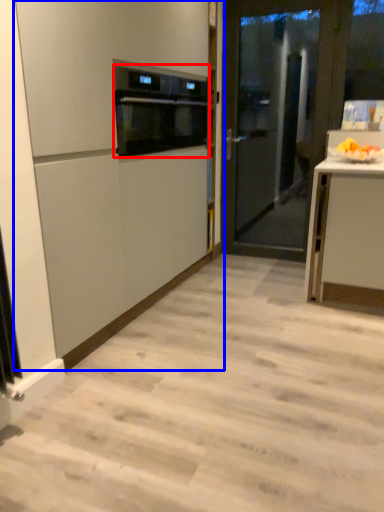
Question: Which object appears closest to the camera in this image, kitchen appliance (highlighted by a red box) or cabinetry (highlighted by a blue box)?

Choices:
 (A) kitchen appliance
 (B) cabinetry

Answer: (B)